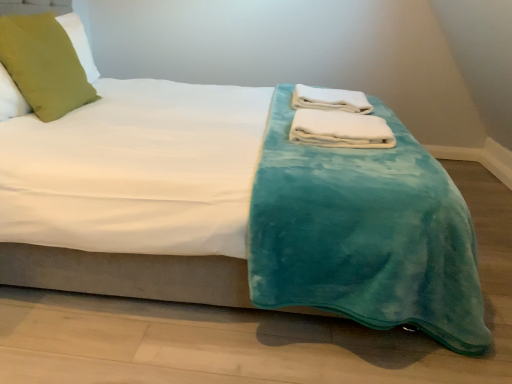
Question: Which direction should I rotate to look at white soft towel at center, positioned as the 1th bath towel in top-to-bottom order, — up or down?

Choices:
 (A) up
 (B) down

Answer: (A)

Question: Can green fabric pillow at upper left be found inside white soft towel at center, positioned as the first bath towel in front-to-back order?

Choices:
 (A) no
 (B) yes

Answer: (A)

Question: Can you confirm if white soft towel at center, which appears as the 2th bath towel when viewed from the top, is positioned to the right of green fabric pillow at upper left?

Choices:
 (A) no
 (B) yes

Answer: (B)

Question: From the image's perspective, would you say white soft towel at center, positioned as the first bath towel in front-to-back order, is shown under green fabric pillow at upper left?

Choices:
 (A) yes
 (B) no

Answer: (A)

Question: Does white soft towel at center, which is the 1th bath towel in bottom-to-top order, have a larger size compared to green fabric pillow at upper left?

Choices:
 (A) no
 (B) yes

Answer: (A)

Question: Considering the relative sizes of white soft towel at center, which is counted as the 2th bath towel, starting from the back, and green fabric pillow at upper left in the image provided, is white soft towel at center, which is counted as the 2th bath towel, starting from the back, taller than green fabric pillow at upper left?

Choices:
 (A) yes
 (B) no

Answer: (B)

Question: From a real-world perspective, does white soft towel at center, positioned as the first bath towel in front-to-back order, sit lower than green fabric pillow at upper left?

Choices:
 (A) yes
 (B) no

Answer: (A)

Question: Is white soft towel at center, the 2th bath towel positioned from the bottom, behind white soft towel at center, which is counted as the 2th bath towel, starting from the back?

Choices:
 (A) no
 (B) yes

Answer: (B)

Question: Could you tell me if white soft towel at center, the first bath towel positioned from the back, is facing white soft towel at center, positioned as the first bath towel in front-to-back order?

Choices:
 (A) yes
 (B) no

Answer: (B)

Question: Is white soft towel at center, positioned as the 1th bath towel in top-to-bottom order, in contact with white soft towel at center, which appears as the 2th bath towel when viewed from the top?

Choices:
 (A) no
 (B) yes

Answer: (A)

Question: From the image's perspective, would you say white soft towel at center, the second bath towel from the front, is shown under white soft towel at center, which is the 1th bath towel in bottom-to-top order?

Choices:
 (A) no
 (B) yes

Answer: (A)

Question: Does white soft towel at center, the 2th bath towel positioned from the bottom, have a smaller size compared to white soft towel at center, which is the 1th bath towel in bottom-to-top order?

Choices:
 (A) yes
 (B) no

Answer: (B)

Question: From a real-world perspective, is white soft towel at center, positioned as the 1th bath towel in top-to-bottom order, over white soft towel at center, which is counted as the 2th bath towel, starting from the back?

Choices:
 (A) yes
 (B) no

Answer: (A)

Question: From a real-world perspective, does green fabric pillow at upper left sit lower than white soft towel at center, the first bath towel positioned from the back?

Choices:
 (A) no
 (B) yes

Answer: (A)